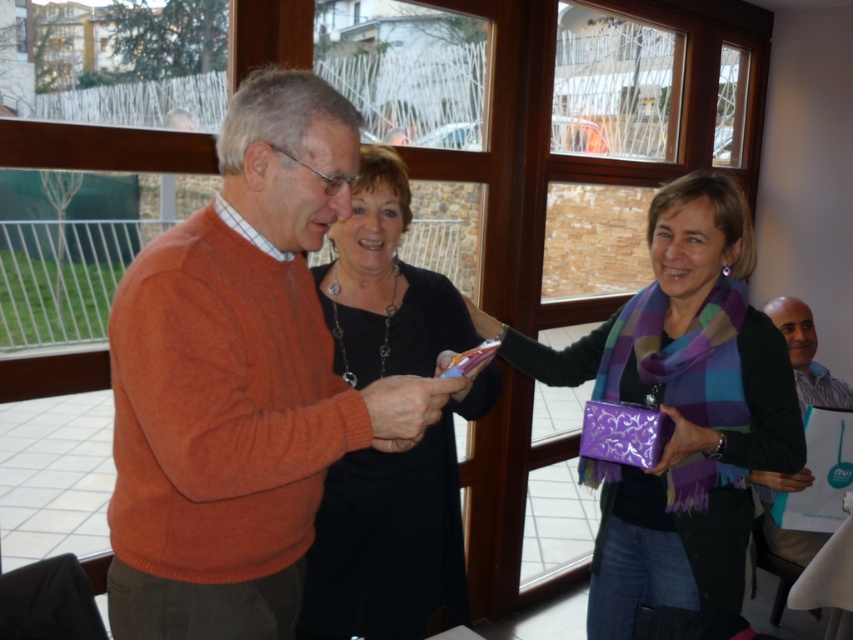
You are standing at point (621, 449) and want to walk to point (432, 593). Is the point you want to reach in front of or behind you?

The point (432, 593) is behind point (621, 449), so the destination is behind you.